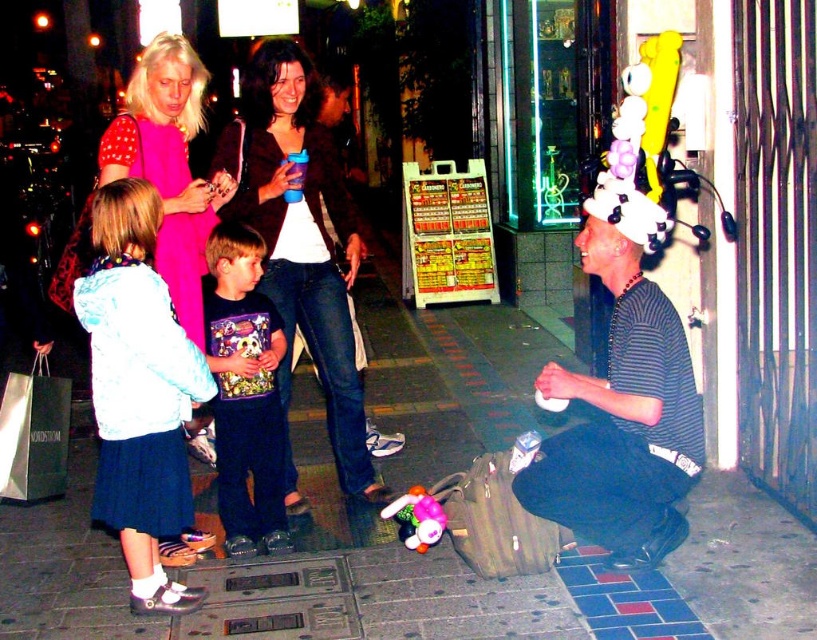
You are a delivery person who needs to hand over a package to the recipient. You see the matte black jacket at center and the plush multicolored toy at lower center. Which object is closer to you?

The plush multicolored toy at lower center is behind the matte black jacket at center, so the matte black jacket at center is closer to you.